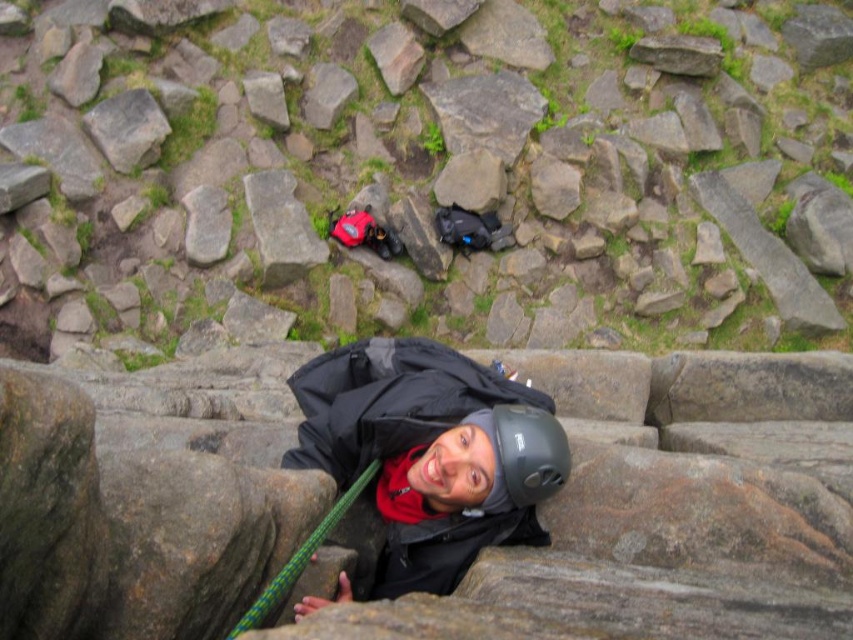
You are a rock climber planning your route. You see a point marked at coordinates (440, 172). What type of rock is located at this point?

The point at coordinates (440, 172) marks a smooth gray rock at center.

You are a safety inspector assessing the climbing site. You notice the matte black helmet at center and the gray rough rock at upper left. Which object is taller?

The gray rough rock at upper left is taller than the matte black helmet at center.

You are a photographer trying to capture the climber and the two backpacks. You notice two points in the scene labeled as point (454, 138) and point (508, 413). Which point is closer to your camera lens?

Point (508, 413) is closer to the camera lens because it is less further than point (454, 138).